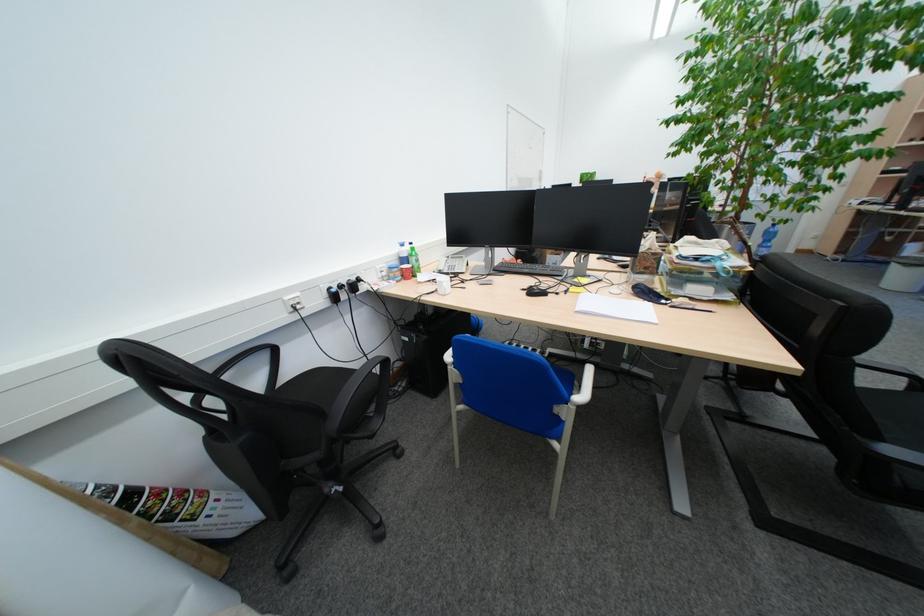
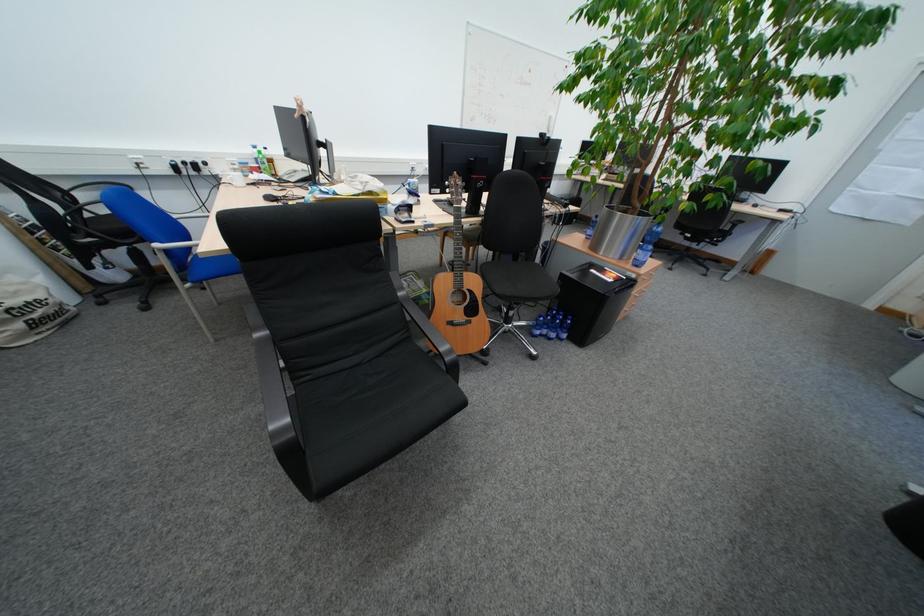
Question: In a continuous first-person perspective shot, in which direction is the camera moving?

Choices:
 (A) Left
 (B) Right
 (C) Forward
 (D) Backward

Answer: (B)